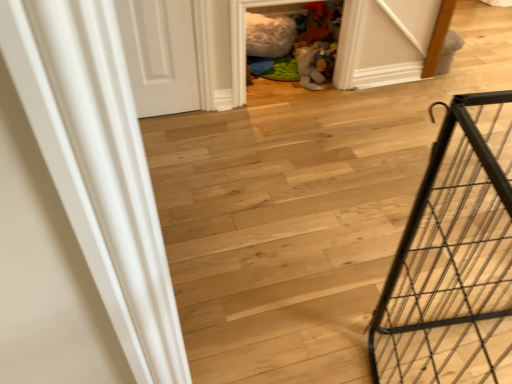
Question: Is wooden floor at center taller than black metal cage at right?

Choices:
 (A) yes
 (B) no

Answer: (B)

Question: Is wooden floor at center to the right of black metal cage at right from the viewer's perspective?

Choices:
 (A) no
 (B) yes

Answer: (B)

Question: Can you confirm if wooden floor at center is positioned to the left of black metal cage at right?

Choices:
 (A) yes
 (B) no

Answer: (B)

Question: Is wooden floor at center positioned beyond the bounds of black metal cage at right?

Choices:
 (A) yes
 (B) no

Answer: (A)

Question: From the image's perspective, is wooden floor at center below black metal cage at right?

Choices:
 (A) no
 (B) yes

Answer: (A)

Question: From the image's perspective, relative to white matte door at upper left, is black metal cage at right above or below?

Choices:
 (A) below
 (B) above

Answer: (A)

Question: Is black metal cage at right situated inside white matte door at upper left or outside?

Choices:
 (A) inside
 (B) outside

Answer: (B)

Question: From a real-world perspective, is black metal cage at right positioned above or below white matte door at upper left?

Choices:
 (A) above
 (B) below

Answer: (A)

Question: Considering the positions of black metal cage at right and white matte door at upper left in the image, is black metal cage at right bigger or smaller than white matte door at upper left?

Choices:
 (A) small
 (B) big

Answer: (B)

Question: Looking at the image, does white matte door at upper left seem bigger or smaller compared to black metal cage at right?

Choices:
 (A) small
 (B) big

Answer: (A)

Question: Based on their positions, is white matte door at upper left located to the left or right of black metal cage at right?

Choices:
 (A) right
 (B) left

Answer: (B)

Question: Is white matte door at upper left inside or outside of black metal cage at right?

Choices:
 (A) inside
 (B) outside

Answer: (B)

Question: From the image's perspective, is white matte door at upper left located above or below black metal cage at right?

Choices:
 (A) above
 (B) below

Answer: (A)

Question: Is point (174, 4) positioned closer to the camera than point (294, 278)?

Choices:
 (A) farther
 (B) closer

Answer: (A)

Question: Is white matte door at upper left wider or thinner than wooden floor at center?

Choices:
 (A) wide
 (B) thin

Answer: (B)